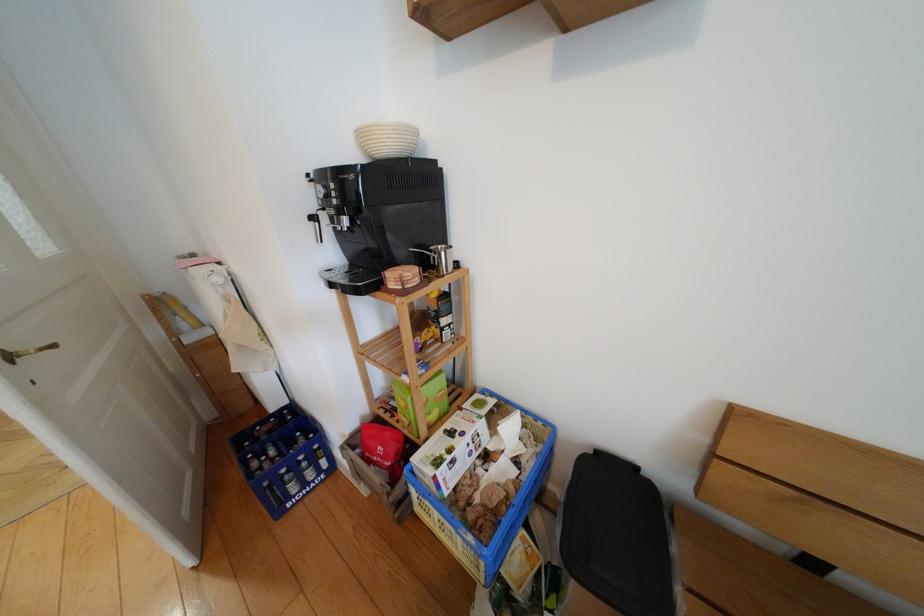
This screenshot has height=616, width=924. In order to click on chair sitting surface in this screenshot , I will do `click(769, 580)`.